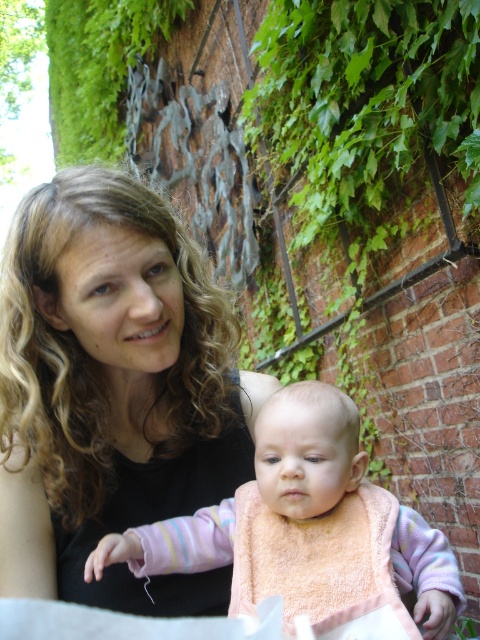
Question: Which object is farther from the camera taking this photo?

Choices:
 (A) black matte hair at upper left
 (B) pink terry cloth bib at center

Answer: (A)

Question: Does black matte hair at upper left come behind pink terry cloth bib at center?

Choices:
 (A) no
 (B) yes

Answer: (B)

Question: Which point is closer to the camera?

Choices:
 (A) black matte hair at upper left
 (B) pink terry cloth bib at center

Answer: (B)

Question: Among these points, which one is farthest from the camera?

Choices:
 (A) [x=17, y=588]
 (B) [x=430, y=604]

Answer: (A)

Question: Does black matte hair at upper left appear over pink terry cloth bib at center?

Choices:
 (A) no
 (B) yes

Answer: (B)

Question: Is black matte hair at upper left positioned before pink terry cloth bib at center?

Choices:
 (A) yes
 (B) no

Answer: (B)